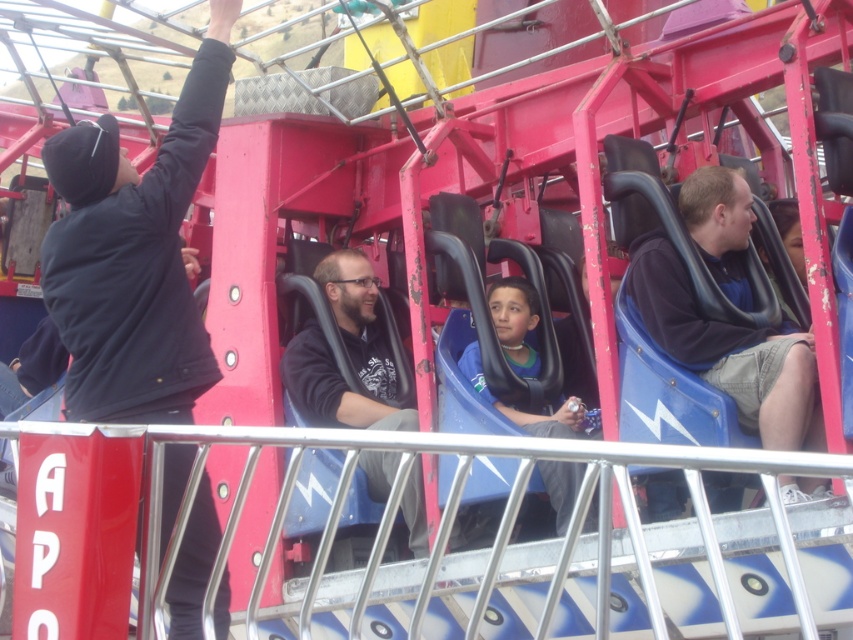
You are standing at the fairground and see two points marked in the image. The first point is at coordinates point (225, 627) and the second is at point (531, 355). Which point is closer to you?

Point (225, 627) is in front of point (531, 355), so it is closer to you.

You are a photographer trying to capture a clear photo of the blue matte seat at center without the black matte jacket at upper left blocking it. Which object should you move closer to in order to frame the shot better?

To avoid the black matte jacket at upper left blocking the blue matte seat at center, move closer to the blue matte seat at center since it might be narrower than the black matte jacket at upper left.